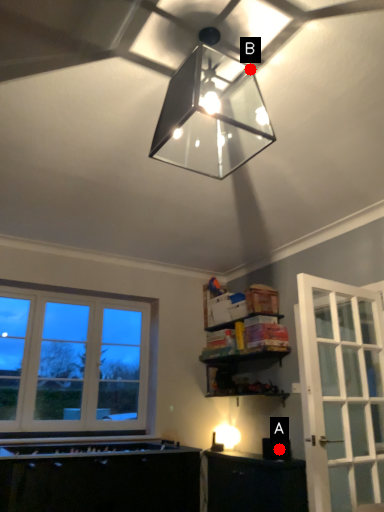
Question: Two points are circled on the image, labeled by A and B beside each circle. Which point is closer to the camera?

Choices:
 (A) A is closer
 (B) B is closer

Answer: (B)